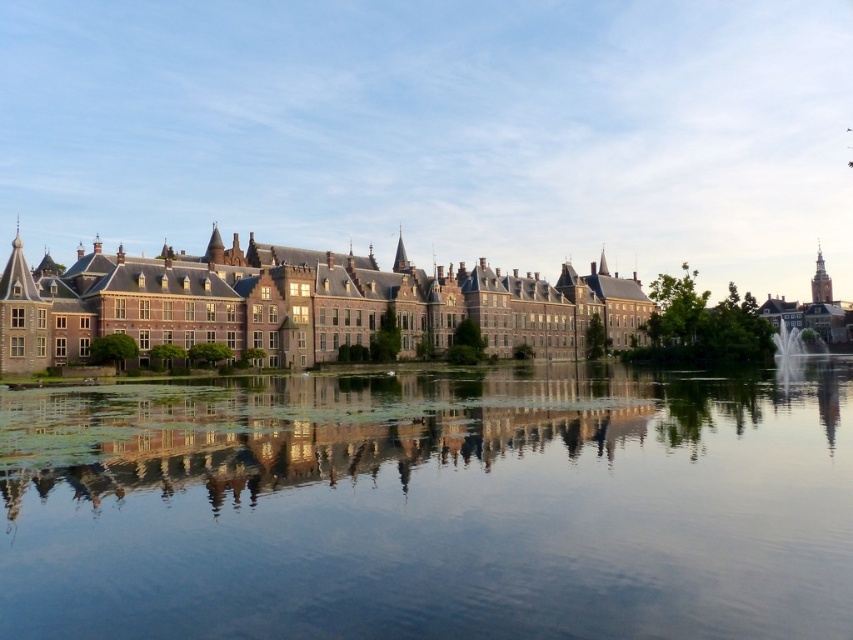
You are standing at the point labeled point (244,497) and want to take a photo of the historic building complex. If the camera you are using has a focal length of 50mm and you want to capture the entire scene in one shot without moving, what is the minimum distance you need to be from the buildings to ensure the entire complex fits in the frame?

To determine the minimum distance required, we can use the formula for field of view in photography. The formula is Field of View in degrees equals 2 times arctangent of the sensor size divided by 2 times focal length. Assuming a full frame sensor with a width of 36mm, the calculation would be 2 times arctangent of 36 divided by 2 times 50. This results in approximately 46 degrees. However, since the buildings are symmetrical and spread out, you would need to position yourself at least 47.33 meters away to

You are an architect analyzing the symmetry of the scene. Given that the transparent glass water at center and the brick stone palace at center are both central elements, which one appears to occupy a larger area in the image?

The brick stone palace at center occupies a larger area than the transparent glass water at center, as stated in the description that the water has a smaller size compared to the palace.

You are an architect analyzing the symmetry of the scene. Based on the image, which object is positioned directly above the other between the transparent glass water at center and the brick stone palace at center?

The brick stone palace at center is positioned directly above the transparent glass water at center.